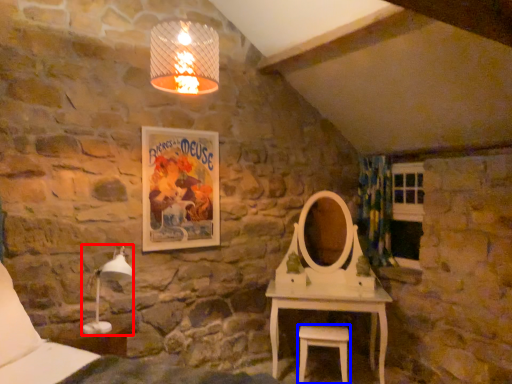
Question: Which of the following is the closest to the observer, table lamp (highlighted by a red box) or stool (highlighted by a blue box)?

Choices:
 (A) table lamp
 (B) stool

Answer: (A)